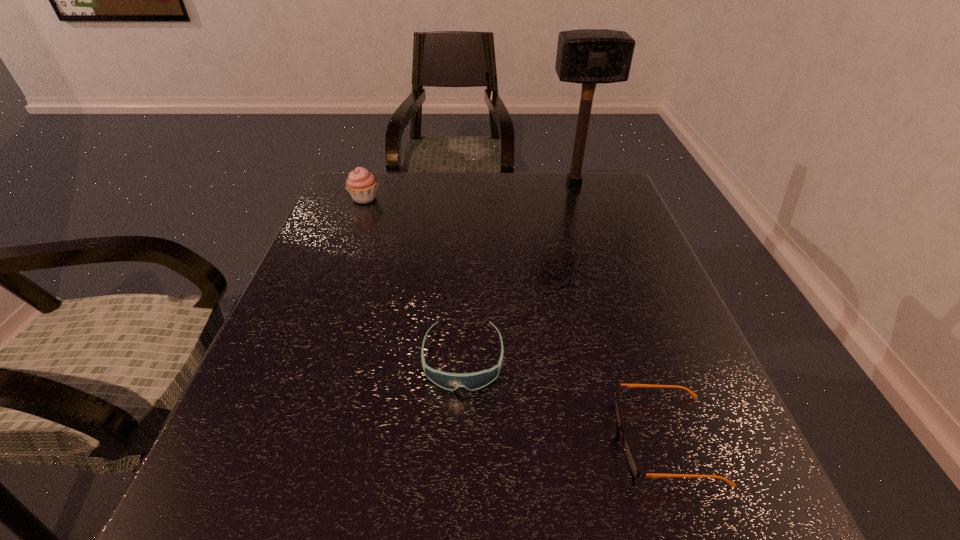
Identify the location of object at the far right corner. (589, 56).

Locate an element on the screen. This screenshot has width=960, height=540. object present at the near right corner is located at coordinates click(x=634, y=467).

What are the coordinates of `vacant space at the far edge of the desktop` in the screenshot? It's located at (408, 180).

Locate an element on the screen. The image size is (960, 540). vacant area at the near edge of the desktop is located at coordinates (383, 536).

You are a GUI agent. You are given a task and a screenshot of the screen. Output one action in this format:
    pyautogui.click(x=<x>, y=<y>)
    Task: Click on the vacant region at the left edge of the desktop
    This screenshot has width=960, height=540.
    Given the screenshot: What is the action you would take?
    pyautogui.click(x=292, y=467)

In the image, there is a desktop. Identify the location of free space at the right edge. (691, 373).

You are a GUI agent. You are given a task and a screenshot of the screen. Output one action in this format:
    pyautogui.click(x=<x>, y=<y>)
    Task: Click on the blank space at the far left corner
    This screenshot has width=960, height=540.
    Given the screenshot: What is the action you would take?
    pyautogui.click(x=379, y=187)

This screenshot has height=540, width=960. In the image, there is a desktop. In order to click on vacant space at the near right corner in this screenshot , I will do `click(676, 505)`.

Locate an element on the screen. vacant area that lies between the shortest object and the tallest object is located at coordinates (620, 311).

The height and width of the screenshot is (540, 960). I want to click on vacant space that's between the goggles and the tallest object, so click(x=518, y=272).